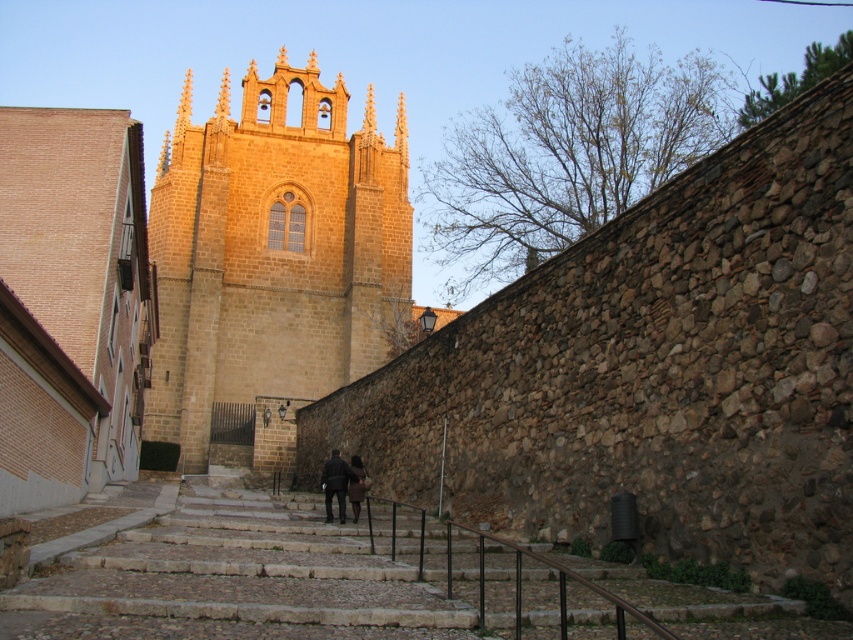
Who is more forward, (172, 365) or (358, 467)?

Point (358, 467) is in front.

Is golden stone tower at center positioned in front of dark brown leather coat at center?

No, it is not.

Is point (281, 259) farther from camera compared to point (358, 508)?

Yes, point (281, 259) is behind point (358, 508).

You are a GUI agent. You are given a task and a screenshot of the screen. Output one action in this format:
    pyautogui.click(x=<x>, y=<y>)
    Task: Click on the golden stone tower at center
    This screenshot has width=853, height=640.
    Given the screenshot: What is the action you would take?
    pyautogui.click(x=273, y=264)

Is dark brown leather jacket at center thinner than dark brown leather coat at center?

No, dark brown leather jacket at center is not thinner than dark brown leather coat at center.

Between point (328, 515) and point (358, 493), which one is positioned behind?

Point (358, 493)

Who is more distant from viewer, (341, 506) or (361, 490)?

Positioned behind is point (361, 490).

Where is `dark brown leather jacket at center`? The width and height of the screenshot is (853, 640). dark brown leather jacket at center is located at coordinates click(335, 483).

Between golden stone tower at center and dark brown leather jacket at center, which one is positioned higher?

golden stone tower at center is higher up.

Is point (409, 246) more distant than point (335, 464)?

Yes, it is behind point (335, 464).

Which is in front, point (315, 198) or point (328, 492)?

Point (328, 492) is in front.

Locate an element on the screen. The width and height of the screenshot is (853, 640). golden stone tower at center is located at coordinates (273, 264).